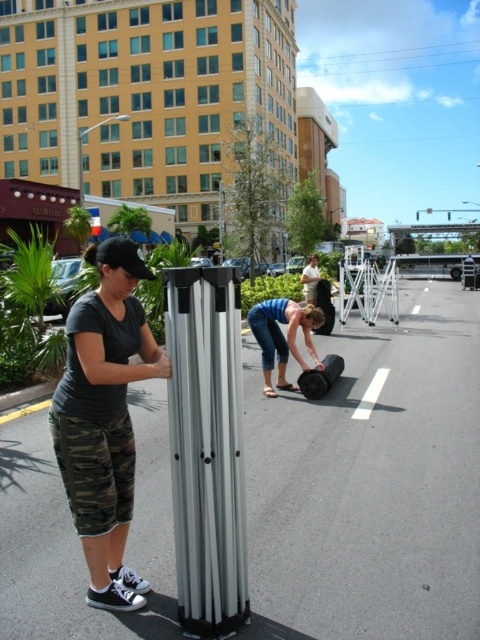
You are a pedestrian walking down the street and see the camo pants at lower left and the blue denim jeans at lower center. Which set of clothing is positioned more to the left side of the street?

The camo pants at lower left are positioned more to the left side of the street compared to the blue denim jeans at lower center.

You are a photographer trying to capture a candid shot of both the blue denim jeans at lower center and the white matte shirt at center. Since you want to ensure both are in focus, you need to know which one is narrower. Which object is narrower?

The blue denim jeans at lower center has a lesser width compared to the white matte shirt at center, so the blue denim jeans at lower center is narrower.